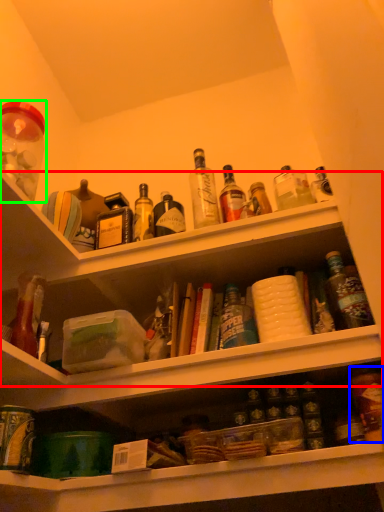
Question: Which object is positioned closest to shelf (highlighted by a red box)? Select from bottle (highlighted by a blue box) and beverage (highlighted by a green box).

Choices:
 (A) bottle
 (B) beverage

Answer: (B)